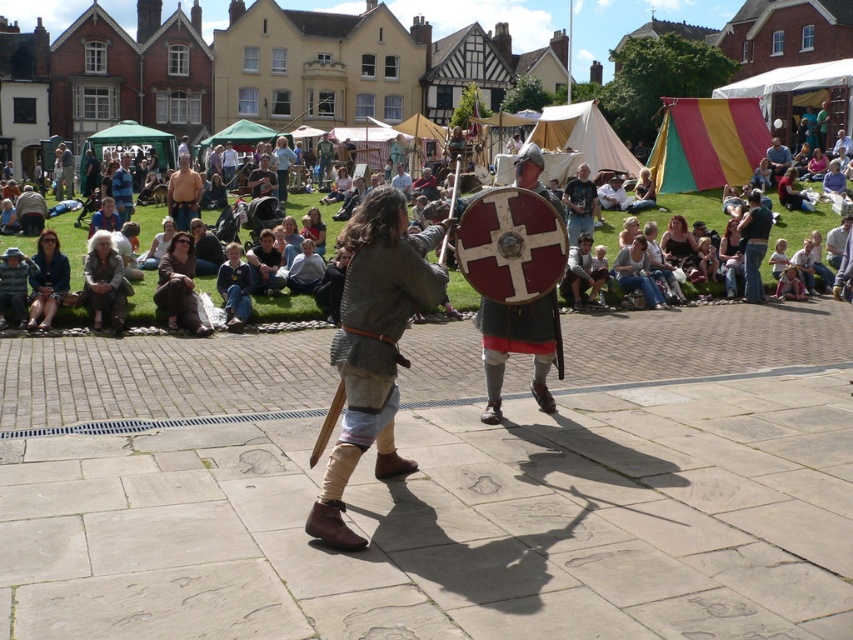
Question: Which is farther from the smooth brown leather jacket at center?

Choices:
 (A) light brown fabric seats at center
 (B) dark gray t-shirt at center
 (C) smooth leather belt at center

Answer: (C)

Question: Can you confirm if light brown fabric seats at center is thinner than dark gray t-shirt at center?

Choices:
 (A) yes
 (B) no

Answer: (B)

Question: Considering the relative positions of dark gray t-shirt at center and smooth brown leather jacket at center in the image provided, where is dark gray t-shirt at center located with respect to smooth brown leather jacket at center?

Choices:
 (A) above
 (B) below

Answer: (B)

Question: Which object is closer to the camera taking this photo?

Choices:
 (A) light brown fabric seats at center
 (B) smooth brown leather jacket at center
 (C) dark gray t-shirt at center
 (D) smooth leather belt at center

Answer: (A)

Question: In this image, where is smooth leather belt at center located relative to smooth brown leather jacket at center?

Choices:
 (A) left
 (B) right

Answer: (A)

Question: Which point is closer to the camera taking this photo?

Choices:
 (A) (187, 184)
 (B) (782, 172)

Answer: (A)